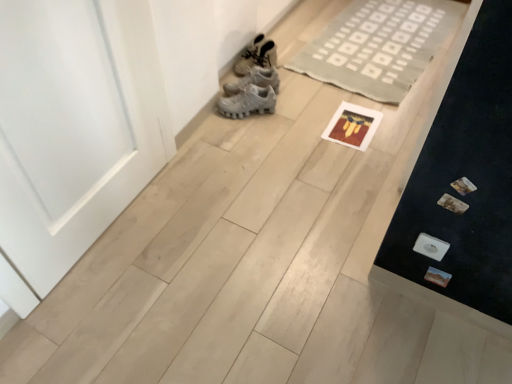
Find the location of a particular element. vacant space in white matte door at left (from a real-world perspective) is located at coordinates (118, 228).